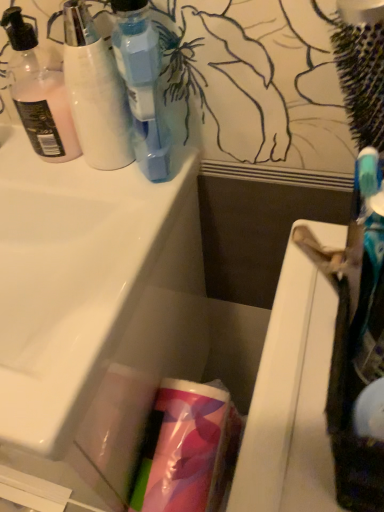
In order to face translucent plastic bottle at upper left, the 2th bottle positioned from the left, should I rotate leftwards or rightwards?

Turn left by 14.101 degrees to look at translucent plastic bottle at upper left, the 2th bottle positioned from the left.

Describe the element at coordinates (141, 84) in the screenshot. I see `transparent plastic bottle at upper left, which is the 3th bottle in left-to-right order` at that location.

This screenshot has width=384, height=512. What do you see at coordinates (184, 449) in the screenshot?
I see `translucent plastic roll at center` at bounding box center [184, 449].

Measure the distance between translucent pink lotion at left, which is the third bottle from right to left, and camera.

19.53 inches.

Where is `white glossy sink at center`? white glossy sink at center is located at coordinates (90, 284).

Find the location of a particular element. This screenshot has height=512, width=384. translucent plastic bottle at upper left, which is the second bottle from right to left is located at coordinates (95, 92).

Between white glossy sink at center and translucent pink lotion at left, which is the third bottle from right to left, which one appears on the right side from the viewer's perspective?

translucent pink lotion at left, which is the third bottle from right to left.

Is point (44, 400) closer or farther from the camera than point (38, 145)?

Clearly, point (44, 400) is closer to the camera than point (38, 145).

Can you confirm if translucent plastic roll at center is wider than translucent pink lotion at left, which is the third bottle from right to left?

Yes, translucent plastic roll at center is wider than translucent pink lotion at left, which is the third bottle from right to left.

Can you confirm if translucent plastic roll at center is shorter than translucent pink lotion at left, which is the first bottle in left-to-right order?

Incorrect, the height of translucent plastic roll at center does not fall short of that of translucent pink lotion at left, which is the first bottle in left-to-right order.

Considering the positions of point (191, 482) and point (13, 17), is point (191, 482) closer or farther from the camera than point (13, 17)?

Point (191, 482) appears to be farther away from the viewer than point (13, 17).

Looking at this image, is transparent plastic bottle at upper left, the 1th bottle from the right, oriented away from white glossy sink at center?

No, transparent plastic bottle at upper left, the 1th bottle from the right,'s orientation is not away from white glossy sink at center.

How different are the orientations of transparent plastic bottle at upper left, the 1th bottle from the right, and white glossy sink at center in degrees?

transparent plastic bottle at upper left, the 1th bottle from the right, and white glossy sink at center are facing 0.00504 degrees away from each other.

Where is `sink on the left of transparent plastic bottle at upper left, the 1th bottle from the right`? sink on the left of transparent plastic bottle at upper left, the 1th bottle from the right is located at coordinates (90, 284).

Is transparent plastic bottle at upper left, which is the 3th bottle in left-to-right order, wider than white glossy sink at center?

No, transparent plastic bottle at upper left, which is the 3th bottle in left-to-right order, is not wider than white glossy sink at center.

Can you confirm if transparent plastic bottle at upper left, the 1th bottle from the right, is positioned to the left of translucent plastic roll at center?

Yes.

Choose the correct answer: Is transparent plastic bottle at upper left, which is the 3th bottle in left-to-right order, inside translucent plastic roll at center or outside it?

transparent plastic bottle at upper left, which is the 3th bottle in left-to-right order, is not enclosed by translucent plastic roll at center.

From a real-world perspective, which is physically below, transparent plastic bottle at upper left, which is the 3th bottle in left-to-right order, or translucent plastic roll at center?

translucent plastic roll at center is physically lower.

Which object is closer to the camera taking this photo, transparent plastic bottle at upper left, the 1th bottle from the right, or translucent plastic roll at center?

transparent plastic bottle at upper left, the 1th bottle from the right.

From the image's perspective, is translucent plastic bottle at upper left, the 2th bottle positioned from the left, positioned above or below transparent plastic bottle at upper left, the 1th bottle from the right?

Clearly, from the image's perspective, translucent plastic bottle at upper left, the 2th bottle positioned from the left, is above transparent plastic bottle at upper left, the 1th bottle from the right.

Find the location of a particular element. the 1st bottle above the transparent plastic bottle at upper left, the 1th bottle from the right (from the image's perspective) is located at coordinates (95, 92).

In the scene shown: Who is bigger, translucent plastic bottle at upper left, the 2th bottle positioned from the left, or transparent plastic bottle at upper left, the 1th bottle from the right?

Answer: transparent plastic bottle at upper left, the 1th bottle from the right.

Is translucent plastic bottle at upper left, the 2th bottle positioned from the left, not near transparent plastic bottle at upper left, which is the 3th bottle in left-to-right order?

That's not correct — translucent plastic bottle at upper left, the 2th bottle positioned from the left, is a little close to transparent plastic bottle at upper left, which is the 3th bottle in left-to-right order.

Considering the sizes of objects translucent pink lotion at left, which is the first bottle in left-to-right order, and white glossy sink at center in the image provided, who is shorter, translucent pink lotion at left, which is the first bottle in left-to-right order, or white glossy sink at center?

translucent pink lotion at left, which is the first bottle in left-to-right order.

Can you tell me how much translucent pink lotion at left, which is the first bottle in left-to-right order, and white glossy sink at center differ in facing direction?

The angle between the facing direction of translucent pink lotion at left, which is the first bottle in left-to-right order, and the facing direction of white glossy sink at center is 0.0028 degrees.

From the image's perspective, which one is positioned lower, translucent pink lotion at left, which is the first bottle in left-to-right order, or white glossy sink at center?

white glossy sink at center.

Is translucent pink lotion at left, which is the third bottle from right to left, oriented away from white glossy sink at center?

That's not correct — translucent pink lotion at left, which is the third bottle from right to left, is not looking away from white glossy sink at center.

How much distance is there between translucent plastic roll at center and white glossy sink at center?

translucent plastic roll at center is 7.98 inches away from white glossy sink at center.

Considering the sizes of objects translucent plastic roll at center and white glossy sink at center in the image provided, who is smaller, translucent plastic roll at center or white glossy sink at center?

Smaller between the two is translucent plastic roll at center.

From the image's perspective, does translucent plastic roll at center appear lower than white glossy sink at center?

Correct, translucent plastic roll at center appears lower than white glossy sink at center in the image.

In order to click on sink in front of the translucent plastic roll at center in this screenshot , I will do `click(90, 284)`.

This screenshot has width=384, height=512. I want to click on sink that is on the left side of translucent pink lotion at left, which is the third bottle from right to left, so click(90, 284).

Image resolution: width=384 pixels, height=512 pixels. In order to click on cleaning product below the translucent pink lotion at left, which is the first bottle in left-to-right order (from the image's perspective) in this screenshot , I will do `click(184, 449)`.

Estimate the real-world distances between objects in this image. Which object is closer to translucent plastic bottle at upper left, the 2th bottle positioned from the left, transparent plastic bottle at upper left, the 1th bottle from the right, or translucent plastic roll at center?

Based on the image, transparent plastic bottle at upper left, the 1th bottle from the right, appears to be nearer to translucent plastic bottle at upper left, the 2th bottle positioned from the left.

Estimate the real-world distances between objects in this image. Which object is further from white glossy sink at center, translucent plastic roll at center or translucent plastic bottle at upper left, the 2th bottle positioned from the left?

Among the two, translucent plastic roll at center is located further to white glossy sink at center.

Estimate the real-world distances between objects in this image. Which object is further from transparent plastic bottle at upper left, the 1th bottle from the right, translucent plastic roll at center or translucent pink lotion at left, which is the first bottle in left-to-right order?

Based on the image, translucent plastic roll at center appears to be further to transparent plastic bottle at upper left, the 1th bottle from the right.

When comparing their distances from translucent pink lotion at left, which is the third bottle from right to left, does transparent plastic bottle at upper left, the 1th bottle from the right, or translucent plastic bottle at upper left, which is the second bottle from right to left, seem closer?

translucent plastic bottle at upper left, which is the second bottle from right to left, is positioned closer to the anchor translucent pink lotion at left, which is the third bottle from right to left.

Estimate the real-world distances between objects in this image. Which object is further from translucent pink lotion at left, which is the first bottle in left-to-right order, translucent plastic bottle at upper left, which is the second bottle from right to left, or white glossy sink at center?

white glossy sink at center.

From the image, which object appears to be nearer to transparent plastic bottle at upper left, which is the 3th bottle in left-to-right order, translucent pink lotion at left, which is the first bottle in left-to-right order, or translucent plastic roll at center?

Among the two, translucent pink lotion at left, which is the first bottle in left-to-right order, is located nearer to transparent plastic bottle at upper left, which is the 3th bottle in left-to-right order.

Estimate the real-world distances between objects in this image. Which object is further from translucent pink lotion at left, which is the third bottle from right to left, transparent plastic bottle at upper left, which is the 3th bottle in left-to-right order, or translucent plastic roll at center?

The object further to translucent pink lotion at left, which is the third bottle from right to left, is translucent plastic roll at center.

Estimate the real-world distances between objects in this image. Which object is further from translucent plastic bottle at upper left, which is the second bottle from right to left, translucent plastic roll at center or white glossy sink at center?

Among the two, translucent plastic roll at center is located further to translucent plastic bottle at upper left, which is the second bottle from right to left.

Identify the location of bottle between translucent plastic bottle at upper left, which is the second bottle from right to left, and translucent plastic roll at center from top to bottom. This screenshot has width=384, height=512. (141, 84).

Image resolution: width=384 pixels, height=512 pixels. What are the coordinates of `sink between translucent pink lotion at left, which is the third bottle from right to left, and translucent plastic roll at center, in the vertical direction` in the screenshot? It's located at (90, 284).

Where is `sink that lies between translucent plastic bottle at upper left, which is the second bottle from right to left, and translucent plastic roll at center from top to bottom`? The width and height of the screenshot is (384, 512). sink that lies between translucent plastic bottle at upper left, which is the second bottle from right to left, and translucent plastic roll at center from top to bottom is located at coordinates (90, 284).

In order to click on bottle between translucent pink lotion at left, which is the first bottle in left-to-right order, and transparent plastic bottle at upper left, the 1th bottle from the right, in the horizontal direction in this screenshot , I will do `click(95, 92)`.